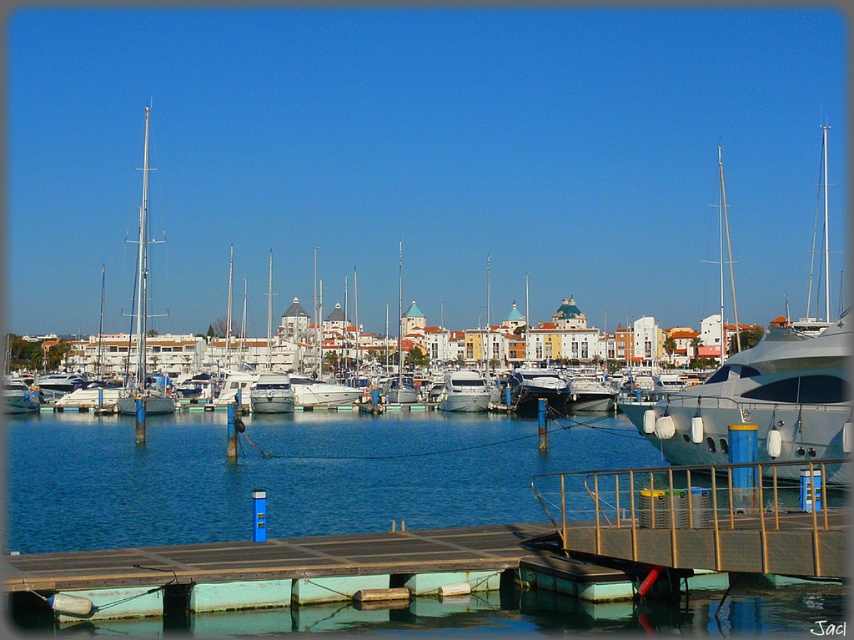
Does silver metallic mast at left appear on the right side of white glossy yacht at center?

Incorrect, silver metallic mast at left is not on the right side of white glossy yacht at center.

Is point (141, 282) less distant than point (474, 392)?

That is True.

Image resolution: width=854 pixels, height=640 pixels. What are the coordinates of `silver metallic mast at left` in the screenshot? It's located at (142, 312).

Looking at this image, is blue water at center smaller than white glossy yacht at center?

No, blue water at center is not smaller than white glossy yacht at center.

Is blue water at center thinner than white glossy yacht at center?

Incorrect, blue water at center's width is not less than white glossy yacht at center's.

Is point (309, 490) in front of point (453, 396)?

Yes, it is.

Find the location of `blue water at center`. blue water at center is located at coordinates (285, 474).

Which is above, metallic gray dock at center or silver metallic mast at left?

silver metallic mast at left is above.

Does metallic gray dock at center have a greater height compared to silver metallic mast at left?

Incorrect, metallic gray dock at center's height is not larger of silver metallic mast at left's.

Who is more distant from viewer, (753, 552) or (164, 390)?

The point (164, 390) is behind.

Identify the location of metallic gray dock at center. The width and height of the screenshot is (854, 640). (705, 516).